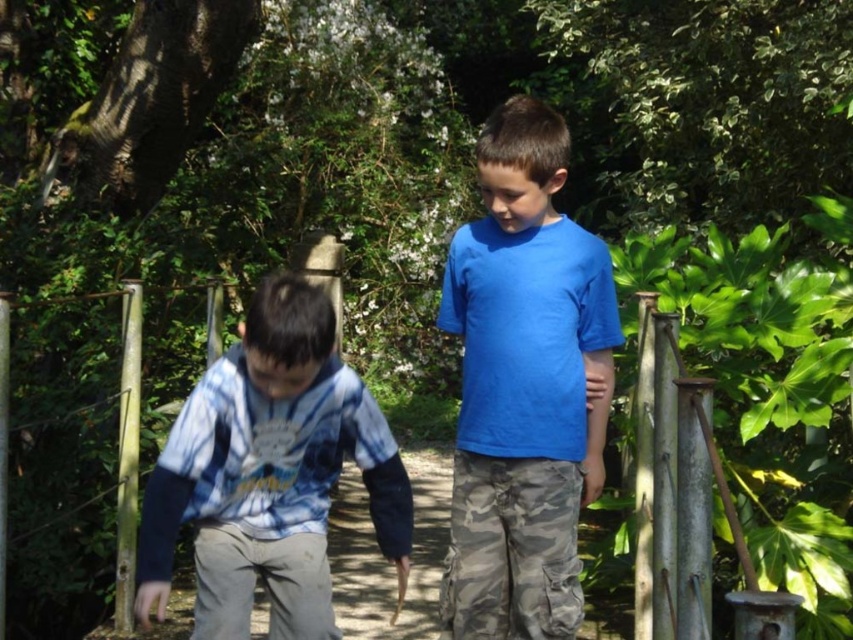
Is point (564, 502) positioned after point (386, 508)?

Yes, it is.

Consider the image. Can you confirm if blue matte shirt at center is positioned to the right of tie-dye fabric shirt at left?

Yes, blue matte shirt at center is to the right of tie-dye fabric shirt at left.

Is point (538, 349) farther from viewer compared to point (178, 417)?

Yes, point (538, 349) is behind point (178, 417).

Identify the location of blue matte shirt at center. The width and height of the screenshot is (853, 640). (524, 387).